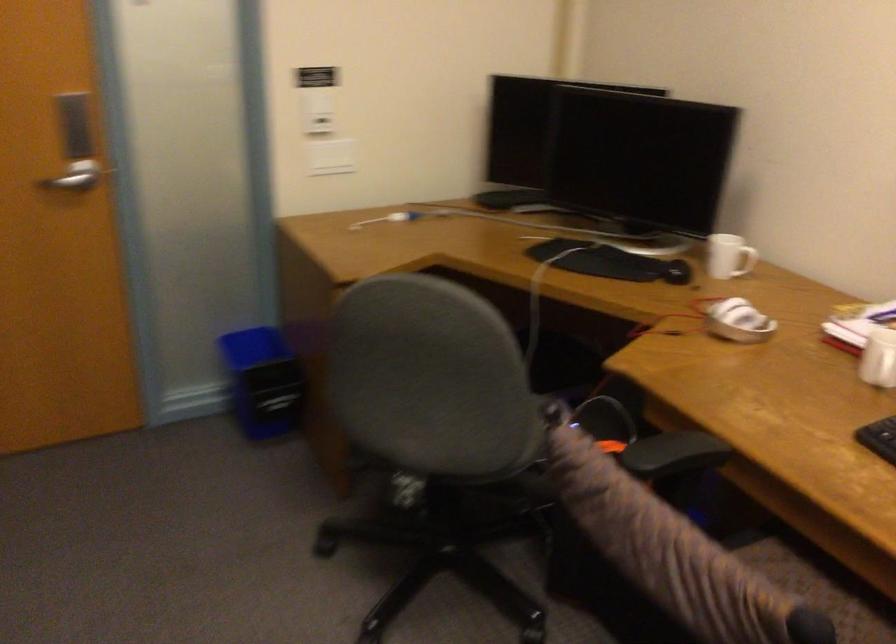
Where would you push the white light switch? Please return your answer as a coordinate pair (x, y).

(331, 156)